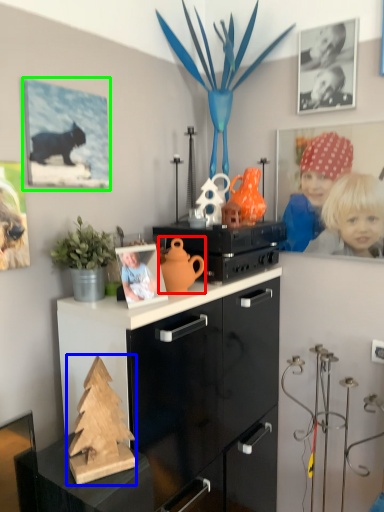
Question: Estimate the real-world distances between objects in this image. Which object is closer to toy (highlighted by a red box), christmas tree (highlighted by a blue box) or picture frame (highlighted by a green box)?

Choices:
 (A) christmas tree
 (B) picture frame

Answer: (A)